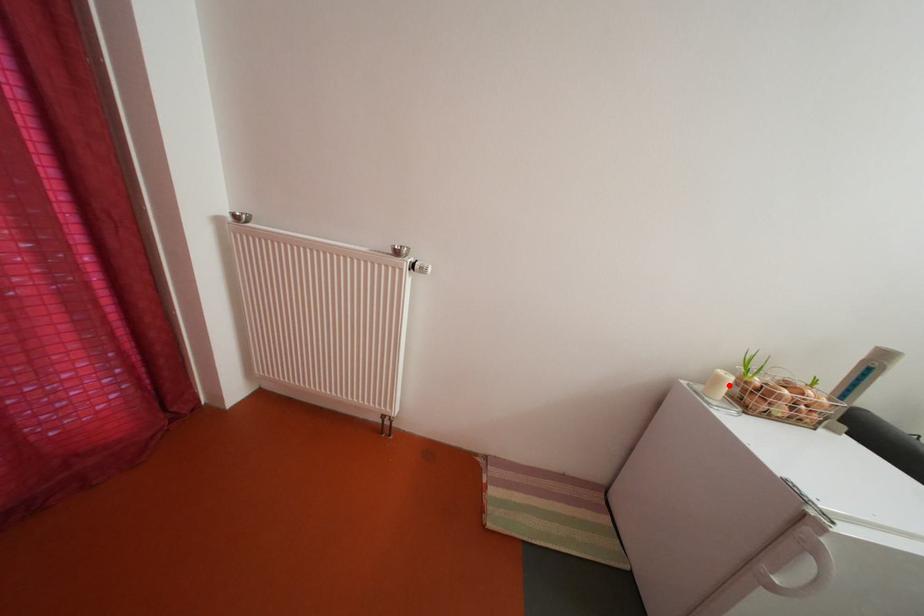
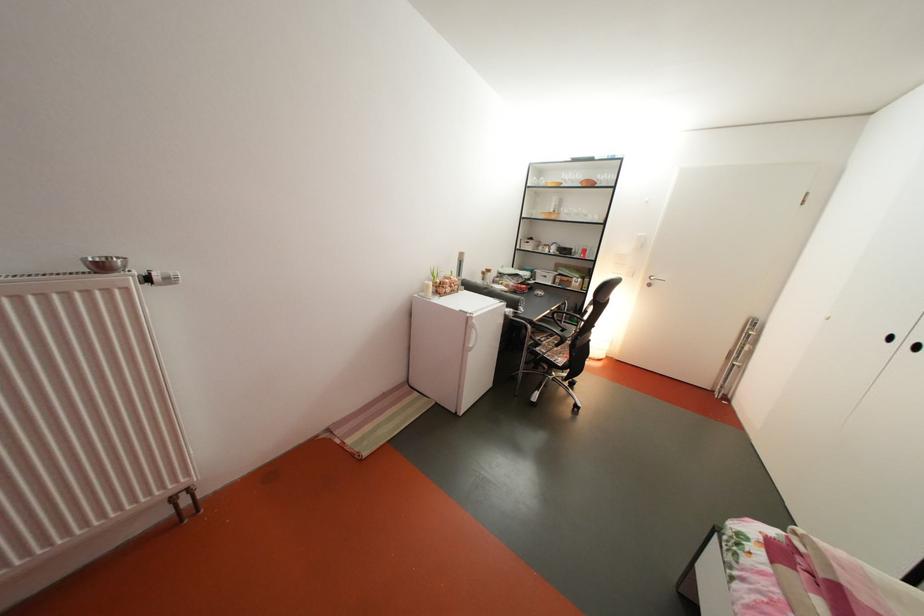
The point at the highlighted location is marked in the first image. Where is the corresponding point in the second image?

(439, 293)